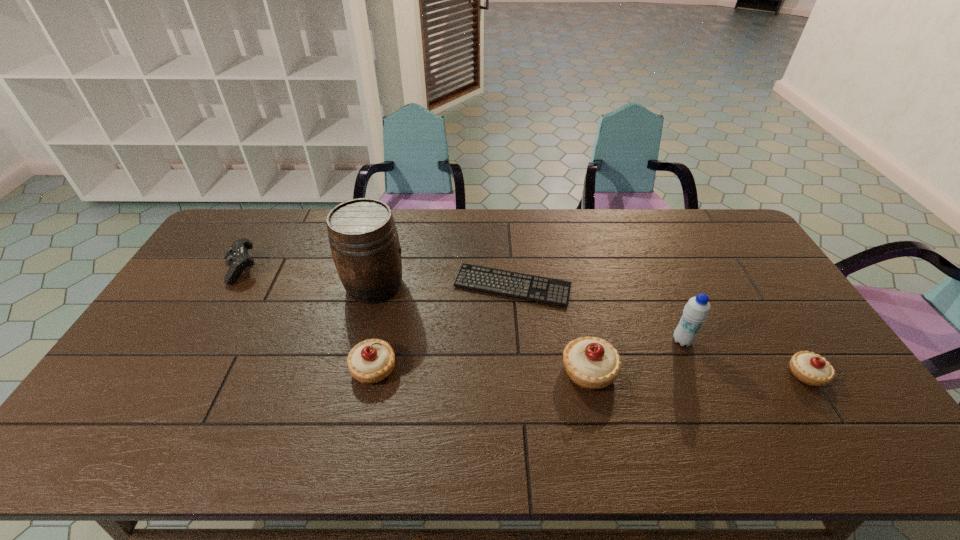
The height and width of the screenshot is (540, 960). In order to click on water bottle in this screenshot , I will do `click(696, 311)`.

Identify the location of blank space located on the left of the second tallest pastry. coord(240,368).

Find the location of `vacant position located 0.260m on the back of the second pastry from left to right`. vacant position located 0.260m on the back of the second pastry from left to right is located at coordinates (570, 285).

I want to click on vacant space located on the back of the rightmost pastry, so click(x=756, y=296).

Where is `free space located 0.230m on the back of the computer keyboard`? Image resolution: width=960 pixels, height=540 pixels. free space located 0.230m on the back of the computer keyboard is located at coordinates (508, 225).

Where is `vacant region located on the right of the leftmost object`? Image resolution: width=960 pixels, height=540 pixels. vacant region located on the right of the leftmost object is located at coordinates (309, 270).

This screenshot has width=960, height=540. I want to click on free region located 0.090m on the side of the cider near the bung hole, so click(434, 285).

This screenshot has height=540, width=960. Identify the location of vacant space located on the back of the sixth shortest object. (660, 289).

Locate an element on the screen. The height and width of the screenshot is (540, 960). object located in the left edge section of the desktop is located at coordinates (237, 257).

At what (x,y) coordinates should I click in order to perform the action: click on object present at the right edge. Please return your answer as a coordinate pair (x, y). Looking at the image, I should click on (810, 368).